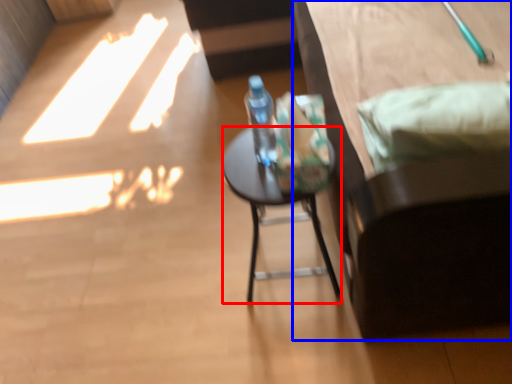
Question: Which point is closer to the camera, desk (highlighted by a red box) or furniture (highlighted by a blue box)?

Choices:
 (A) desk
 (B) furniture

Answer: (B)